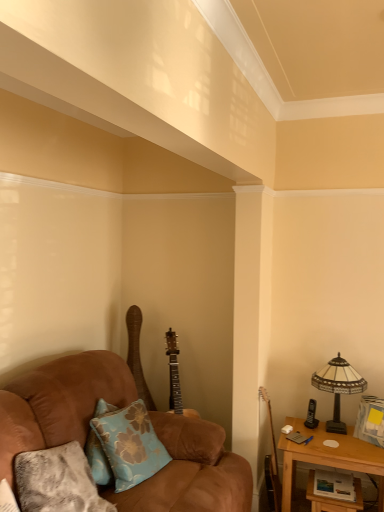
The height and width of the screenshot is (512, 384). Describe the element at coordinates (59, 403) in the screenshot. I see `brown suede couch at left` at that location.

In order to face wooden table at lower right, marked as the first table in a left-to-right arrangement, should I rotate leftwards or rightwards?

A 18.685 degree turn to the right will do.

In order to face textured gray pillow at lower left, which appears as the first pillow when viewed from the front, should I rotate leftwards or rightwards?

To align with it, rotate left about 16.540°.

Measure the distance between textured gray pillow at lower left, which appears as the first pillow when viewed from the front, and camera.

A distance of 5.31 feet exists between textured gray pillow at lower left, which appears as the first pillow when viewed from the front, and camera.

What do you see at coordinates (328, 457) in the screenshot?
I see `wooden table at lower right, positioned as the second table in left-to-right order` at bounding box center [328, 457].

Measure the distance between wooden acoustic guitar at center, which appears as the 2th guitar when viewed from the right, and camera.

wooden acoustic guitar at center, which appears as the 2th guitar when viewed from the right, is 3.02 meters away from camera.

Describe the element at coordinates (137, 355) in the screenshot. I see `wooden acoustic guitar at center, which appears as the first guitar when viewed from the back` at that location.

The height and width of the screenshot is (512, 384). I want to click on stained glass lampshade at right, so click(338, 387).

This screenshot has height=512, width=384. Find the location of `brown suede couch at left`. brown suede couch at left is located at coordinates (59, 403).

Is textured gray pillow at lower left, which appears as the first pillow when viewed from the front, completely or partially outside of blue floral fabric pillow at lower left, which is the 1th pillow in back-to-front order?

That's correct, textured gray pillow at lower left, which appears as the first pillow when viewed from the front, is outside of blue floral fabric pillow at lower left, which is the 1th pillow in back-to-front order.

Does textured gray pillow at lower left, which is the second pillow in back-to-front order, have a larger size compared to blue floral fabric pillow at lower left, the 2th pillow when ordered from front to back?

Indeed, textured gray pillow at lower left, which is the second pillow in back-to-front order, has a larger size compared to blue floral fabric pillow at lower left, the 2th pillow when ordered from front to back.

Is textured gray pillow at lower left, which is the second pillow in back-to-front order, wider than blue floral fabric pillow at lower left, the 2th pillow when ordered from front to back?

Yes.

Looking at the image, does wooden acoustic guitar at center, the 2th guitar when ordered from front to back, seem bigger or smaller compared to stained glass lampshade at right?

In the image, wooden acoustic guitar at center, the 2th guitar when ordered from front to back, appears to be larger than stained glass lampshade at right.

From the image's perspective, relative to stained glass lampshade at right, is wooden acoustic guitar at center, which appears as the first guitar when viewed from the back, above or below?

wooden acoustic guitar at center, which appears as the first guitar when viewed from the back, is above stained glass lampshade at right.

Which object is more forward, wooden acoustic guitar at center, which appears as the 2th guitar when viewed from the right, or stained glass lampshade at right?

stained glass lampshade at right is more forward.

Would you consider wooden acoustic guitar at center, which is the 1th guitar in left-to-right order, to be distant from stained glass lampshade at right?

wooden acoustic guitar at center, which is the 1th guitar in left-to-right order, is far away from stained glass lampshade at right.

Can you confirm if wooden acoustic guitar at center, which appears as the 2th guitar when viewed from the right, is shorter than textured gray pillow at lower left, which appears as the first pillow when viewed from the front?

Incorrect, the height of wooden acoustic guitar at center, which appears as the 2th guitar when viewed from the right, does not fall short of that of textured gray pillow at lower left, which appears as the first pillow when viewed from the front.

From a real-world perspective, starting from the wooden acoustic guitar at center, which appears as the 2th guitar when viewed from the right, which pillow is the 2nd one below it? Please provide its 2D coordinates.

[(57, 481)]

Based on the photo, from a real-world perspective, is wooden acoustic guitar at right, which is the second guitar in left-to-right order, located higher than wooden table at lower right, positioned as the second table in left-to-right order?

Yes, from a real-world perspective, wooden acoustic guitar at right, which is the second guitar in left-to-right order, is above wooden table at lower right, positioned as the second table in left-to-right order.

From the image's perspective, relative to wooden table at lower right, which is the 1th table from right to left, is wooden acoustic guitar at right, which ranks as the second guitar in back-to-front order, above or below?

Based on their image positions, wooden acoustic guitar at right, which ranks as the second guitar in back-to-front order, is located above wooden table at lower right, which is the 1th table from right to left.

Does wooden acoustic guitar at right, which is the second guitar in left-to-right order, have a lesser height compared to wooden table at lower right, which is the 1th table from right to left?

In fact, wooden acoustic guitar at right, which is the second guitar in left-to-right order, may be taller than wooden table at lower right, which is the 1th table from right to left.

Considering the relative sizes of wooden acoustic guitar at right, which ranks as the second guitar in back-to-front order, and wooden table at lower right, positioned as the second table in left-to-right order, in the image provided, is wooden acoustic guitar at right, which ranks as the second guitar in back-to-front order, wider than wooden table at lower right, positioned as the second table in left-to-right order,?

No.

Is wooden acoustic guitar at center, which appears as the first guitar when viewed from the back, closer to the viewer compared to blue floral fabric pillow at lower left, which is the 1th pillow in back-to-front order?

No, wooden acoustic guitar at center, which appears as the first guitar when viewed from the back, is behind blue floral fabric pillow at lower left, which is the 1th pillow in back-to-front order.

The width and height of the screenshot is (384, 512). I want to click on guitar to the left of blue floral fabric pillow at lower left, which is the 1th pillow in back-to-front order, so click(137, 355).

Who is smaller, wooden acoustic guitar at center, which is the 1th guitar in left-to-right order, or blue floral fabric pillow at lower left, which is the 1th pillow in back-to-front order?

Smaller between the two is wooden acoustic guitar at center, which is the 1th guitar in left-to-right order.

Considering the relative sizes of wooden acoustic guitar at center, which appears as the 2th guitar when viewed from the right, and blue floral fabric pillow at lower left, the 2th pillow when ordered from front to back, in the image provided, is wooden acoustic guitar at center, which appears as the 2th guitar when viewed from the right, taller than blue floral fabric pillow at lower left, the 2th pillow when ordered from front to back,?

Correct, wooden acoustic guitar at center, which appears as the 2th guitar when viewed from the right, is much taller as blue floral fabric pillow at lower left, the 2th pillow when ordered from front to back.

Does point (312, 374) appear closer or farther from the camera than point (79, 445)?

Point (312, 374) appears to be farther away from the viewer than point (79, 445).

Can you tell me how much stained glass lampshade at right and textured gray pillow at lower left, which appears as the first pillow when viewed from the front, differ in facing direction?

They differ by 80.4 degrees in their facing directions.

Is stained glass lampshade at right outside of textured gray pillow at lower left, which is the second pillow in back-to-front order?

Absolutely, stained glass lampshade at right is external to textured gray pillow at lower left, which is the second pillow in back-to-front order.

Between stained glass lampshade at right and textured gray pillow at lower left, which appears as the first pillow when viewed from the front, which one appears on the right side from the viewer's perspective?

Positioned to the right is stained glass lampshade at right.

Between wooden table at lower right, positioned as the second table in left-to-right order, and textured gray pillow at lower left, which appears as the first pillow when viewed from the front, which one appears on the left side from the viewer's perspective?

From the viewer's perspective, textured gray pillow at lower left, which appears as the first pillow when viewed from the front, appears more on the left side.

Which of these two, wooden table at lower right, which is the 1th table from right to left, or textured gray pillow at lower left, which appears as the first pillow when viewed from the front, stands shorter?

textured gray pillow at lower left, which appears as the first pillow when viewed from the front, is shorter.

Are wooden table at lower right, positioned as the second table in left-to-right order, and textured gray pillow at lower left, which is the second pillow in back-to-front order, located far from each other?

Indeed, wooden table at lower right, positioned as the second table in left-to-right order, is not near textured gray pillow at lower left, which is the second pillow in back-to-front order.

In the scene shown: Is wooden table at lower right, positioned as the second table in left-to-right order, in front of or behind textured gray pillow at lower left, which is the second pillow in back-to-front order, in the image?

wooden table at lower right, positioned as the second table in left-to-right order, is positioned farther from the viewer than textured gray pillow at lower left, which is the second pillow in back-to-front order.

Find the location of a particular element. The height and width of the screenshot is (512, 384). pillow lying above the textured gray pillow at lower left, which is the second pillow in back-to-front order (from the image's perspective) is located at coordinates (123, 446).

Starting from the stained glass lampshade at right, which guitar is the 2nd one to the left? Please provide its 2D coordinates.

[(137, 355)]

Based on their spatial positions, is blue floral fabric pillow at lower left, which is the 1th pillow in back-to-front order, or wooden table at lower right, marked as the first table in a left-to-right arrangement, further from textured gray pillow at lower left, which is the second pillow in back-to-front order?

wooden table at lower right, marked as the first table in a left-to-right arrangement, lies further to textured gray pillow at lower left, which is the second pillow in back-to-front order, than the other object.

Which object lies further to the anchor point wooden acoustic guitar at center, the 2th guitar when ordered from front to back, wooden acoustic guitar at right, which is the second guitar in left-to-right order, or brown suede couch at left?

wooden acoustic guitar at right, which is the second guitar in left-to-right order, is positioned further to the anchor wooden acoustic guitar at center, the 2th guitar when ordered from front to back.

Considering their positions, is brown suede couch at left positioned further to wooden acoustic guitar at center, which is the 1th guitar in left-to-right order, than stained glass lampshade at right?

The object further to wooden acoustic guitar at center, which is the 1th guitar in left-to-right order, is stained glass lampshade at right.

Considering their positions, is brown suede couch at left positioned further to blue floral fabric pillow at lower left, the 2th pillow when ordered from front to back, than wooden acoustic guitar at center, which appears as the 2th guitar when viewed from the right?

wooden acoustic guitar at center, which appears as the 2th guitar when viewed from the right, is further to blue floral fabric pillow at lower left, the 2th pillow when ordered from front to back.

Looking at this image, based on their spatial positions, is wooden table at lower right, placed as the 2th table when sorted from right to left, or wooden acoustic guitar at center, the 2th guitar when ordered from front to back, further from wooden table at lower right, positioned as the second table in left-to-right order?

Based on the image, wooden acoustic guitar at center, the 2th guitar when ordered from front to back, appears to be further to wooden table at lower right, positioned as the second table in left-to-right order.

Based on their spatial positions, is stained glass lampshade at right or wooden acoustic guitar at right, placed as the 1th guitar when sorted from right to left, further from wooden table at lower right, marked as the first table in a left-to-right arrangement?

stained glass lampshade at right lies further to wooden table at lower right, marked as the first table in a left-to-right arrangement, than the other object.

When comparing their distances from stained glass lampshade at right, does wooden table at lower right, marked as the first table in a left-to-right arrangement, or blue floral fabric pillow at lower left, which is the 1th pillow in back-to-front order, seem closer?

The object closer to stained glass lampshade at right is wooden table at lower right, marked as the first table in a left-to-right arrangement.

When comparing their distances from textured gray pillow at lower left, which appears as the first pillow when viewed from the front, does wooden acoustic guitar at right, placed as the 1th guitar when sorted from right to left, or wooden table at lower right, marked as the first table in a left-to-right arrangement, seem closer?

Based on the image, wooden table at lower right, marked as the first table in a left-to-right arrangement, appears to be nearer to textured gray pillow at lower left, which appears as the first pillow when viewed from the front.

The height and width of the screenshot is (512, 384). Identify the location of guitar situated between blue floral fabric pillow at lower left, which is the 1th pillow in back-to-front order, and stained glass lampshade at right from left to right. (271, 463).

This screenshot has height=512, width=384. Identify the location of guitar located between blue floral fabric pillow at lower left, which is the 1th pillow in back-to-front order, and wooden table at lower right, positioned as the second table in left-to-right order, in the left-right direction. (271, 463).

You are a GUI agent. You are given a task and a screenshot of the screen. Output one action in this format:
    pyautogui.click(x=<x>, y=<y>)
    Task: Click on the guitar between blue floral fabric pillow at lower left, the 2th pillow when ordered from front to back, and wooden table at lower right, placed as the 2th table when sorted from right to left, from left to right
    
    Given the screenshot: What is the action you would take?
    pyautogui.click(x=271, y=463)

This screenshot has height=512, width=384. I want to click on pillow located between textured gray pillow at lower left, which appears as the first pillow when viewed from the front, and wooden table at lower right, marked as the first table in a left-to-right arrangement, in the left-right direction, so click(123, 446).